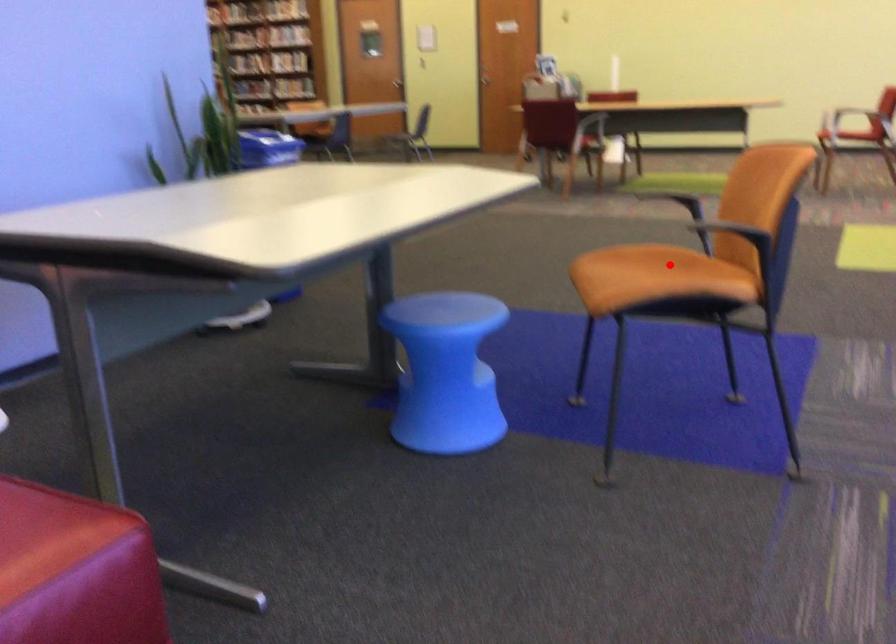
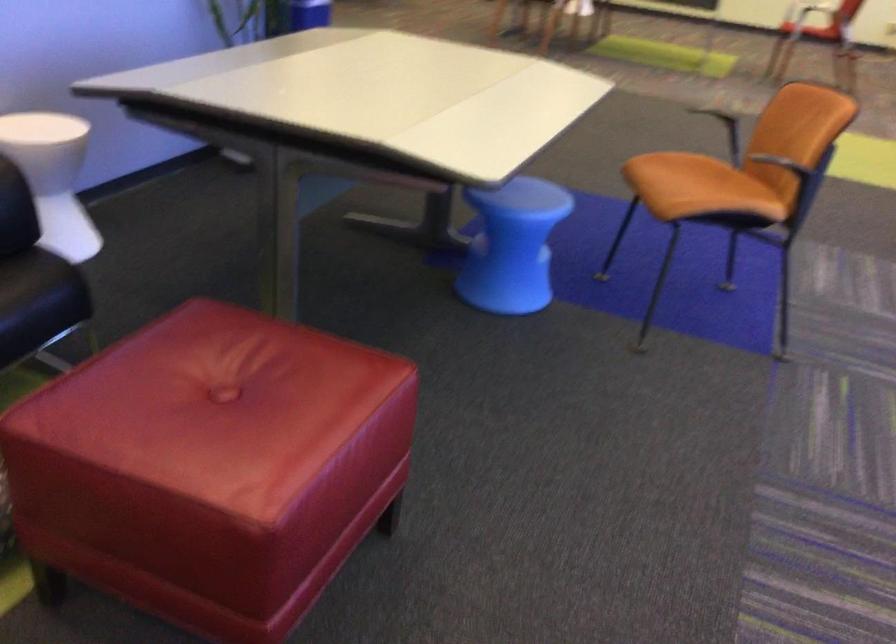
Question: A red point is marked in image1. In image2, is the corresponding 3D point closer to the camera or farther? Reply with the corresponding letter.

Choices:
 (A) The corresponding 3D point is closer.
 (B) The corresponding 3D point is farther.

Answer: (B)